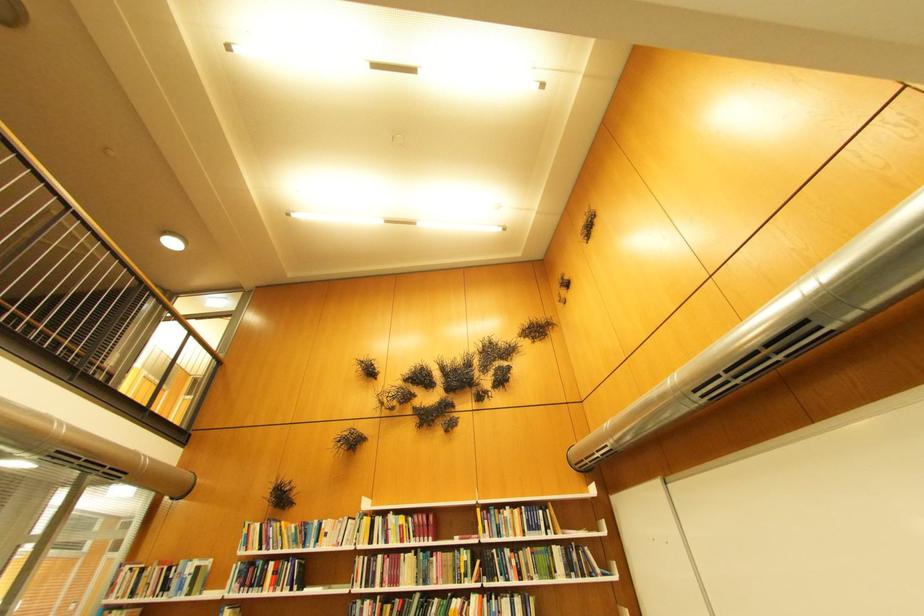
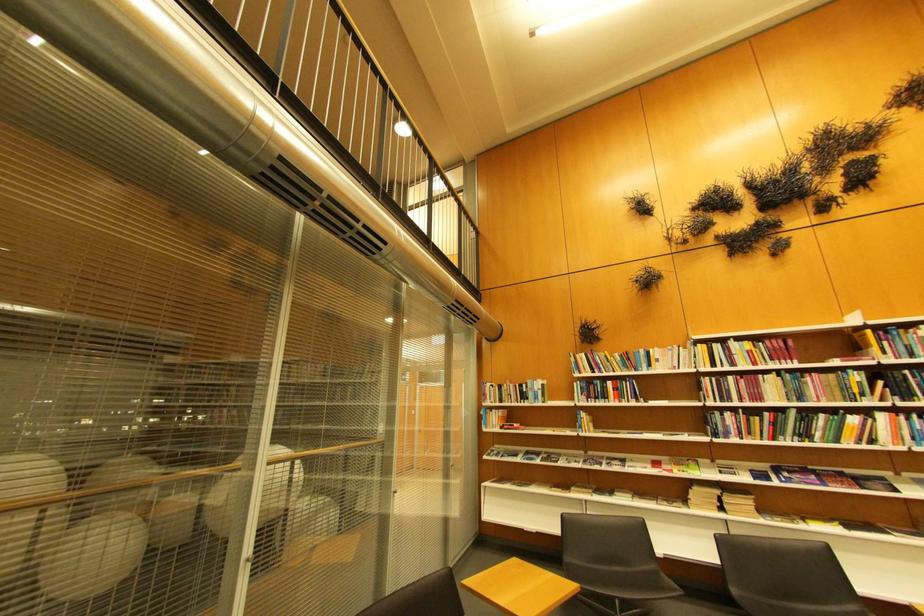
Find the pixel in the second image that matches point (247, 588) in the first image.

(594, 399)